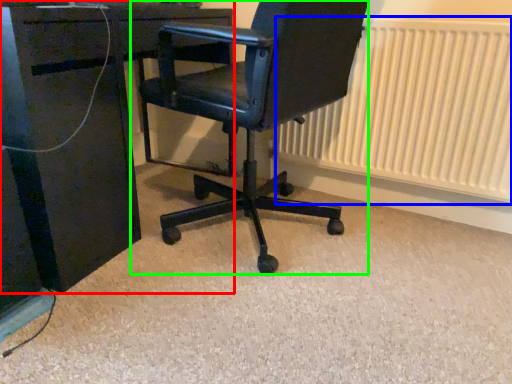
Question: Which is farther away from desk (highlighted by a red box)? radiator (highlighted by a blue box) or chair (highlighted by a green box)?

Choices:
 (A) radiator
 (B) chair

Answer: (A)